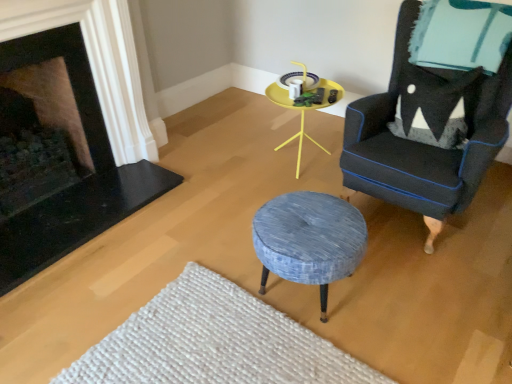
I want to click on vacant space situated on the left part of textured blue fabric stool at center, so click(x=220, y=258).